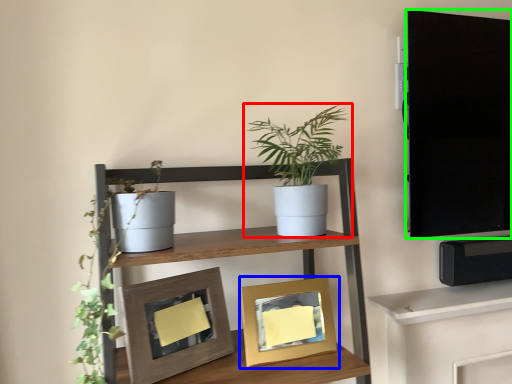
Question: Which object is the closest to the houseplant (highlighted by a red box)? Choose among these: picture frame (highlighted by a blue box) or tv cabinet (highlighted by a green box).

Choices:
 (A) picture frame
 (B) tv cabinet

Answer: (A)